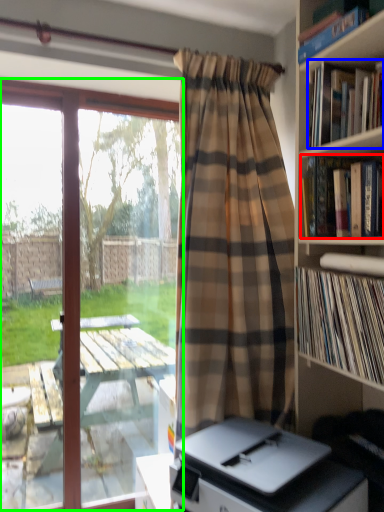
Question: Considering the real-world distances, which object is closest to book (highlighted by a red box)? book (highlighted by a blue box) or window (highlighted by a green box).

Choices:
 (A) book
 (B) window

Answer: (A)